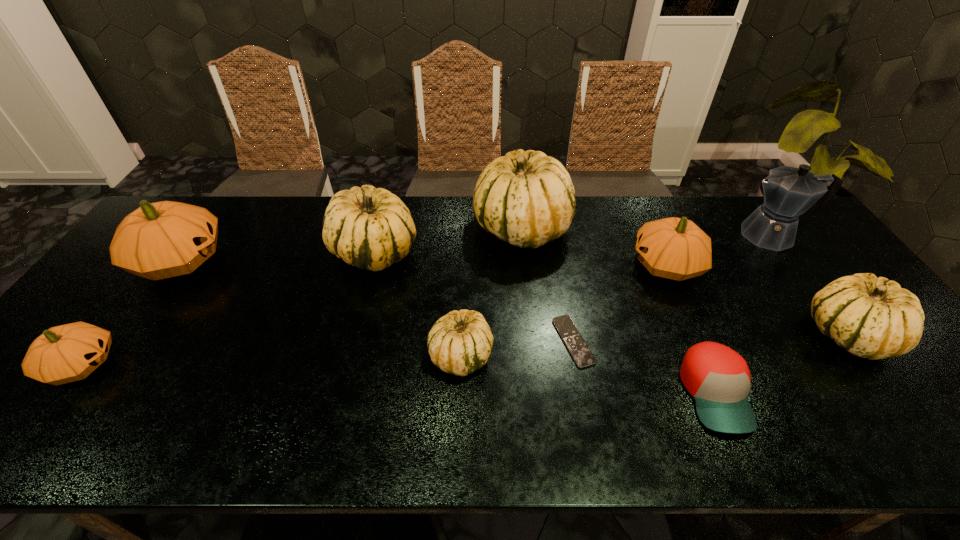
In order to click on the biggest white gourd in this screenshot , I will do `click(527, 199)`.

I want to click on coffeepot, so click(x=789, y=192).

Find the location of a particular element. Image resolution: width=960 pixels, height=540 pixels. the biggest orange gourd is located at coordinates click(x=161, y=240).

Where is `the third gourd from left to right`? The width and height of the screenshot is (960, 540). the third gourd from left to right is located at coordinates (369, 228).

At what (x,y) coordinates should I click in order to perform the action: click on the leftmost white gourd. Please return your answer as a coordinate pair (x, y). Looking at the image, I should click on (369, 228).

Image resolution: width=960 pixels, height=540 pixels. What are the coordinates of `the second biggest orange gourd` in the screenshot? It's located at (675, 248).

You are a GUI agent. You are given a task and a screenshot of the screen. Output one action in this format:
    pyautogui.click(x=<x>, y=<y>)
    Task: Click on the rightmost orange gourd
    The height and width of the screenshot is (540, 960).
    Given the screenshot: What is the action you would take?
    pyautogui.click(x=675, y=248)

The image size is (960, 540). In order to click on the third biggest white gourd in this screenshot , I will do `click(871, 317)`.

Find the location of a particular element. The image size is (960, 540). the rightmost white gourd is located at coordinates (871, 317).

You are a GUI agent. You are given a task and a screenshot of the screen. Output one action in this format:
    pyautogui.click(x=<x>, y=<y>)
    Task: Click on the smallest orange gourd
    The image size is (960, 540).
    Given the screenshot: What is the action you would take?
    pyautogui.click(x=67, y=353)